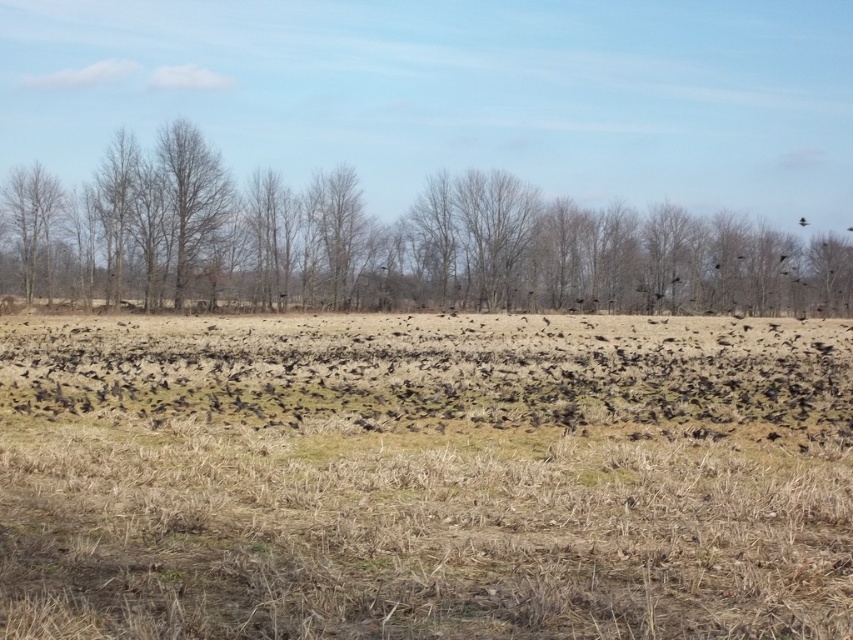
You are a photographer trying to capture the black matte birds at center and the black matte bird at upper right in the same frame. Based on their positions, which direction should you move your camera to include both in the shot?

Since the black matte birds at center are to the left of the black matte bird at upper right, you should move your camera to the left to include both the black matte birds at center and the black matte bird at upper right in the frame.

You are standing in the open field and want to reach the point marked at coordinates (347, 314). If your walking speed is 3 feet per second, how many seconds will it take you to reach that point?

The point marked at coordinates (347, 314) is 153.87 feet away from the camera. At a walking speed of 3 feet per second, it will take 153.87 divided by 3, which equals approximately 51.29 seconds to reach the point.

You are standing at the origin point of the coordinate system in the image. You want to walk towards the black matte birds at center. Which direction should you move in terms of the coordinate system?

You should move towards the coordinates point at 0.578 on the x axis and 0.511 on the y axis to reach the black matte birds at center.